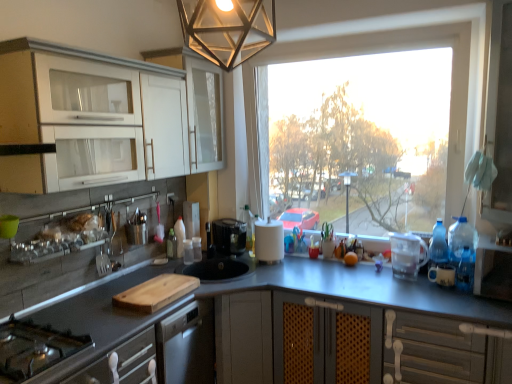
The image size is (512, 384). What are the coordinates of `free space in front of translucent plastic bottle at center, the 3th bottle viewed from the front` in the screenshot? It's located at (168, 270).